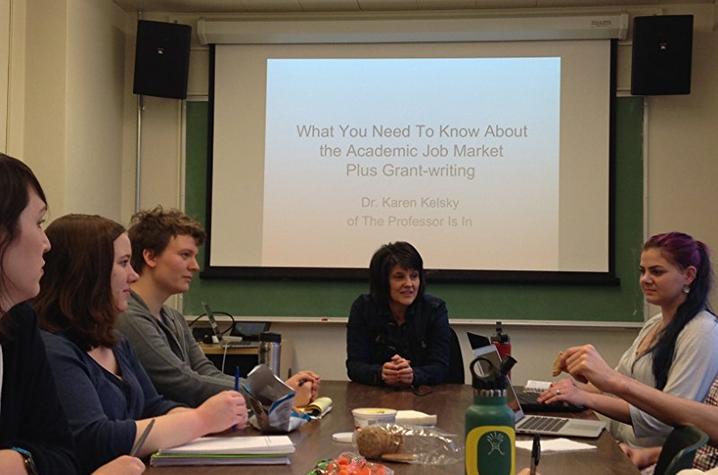
This screenshot has width=718, height=475. I want to click on table, so coord(314,450).